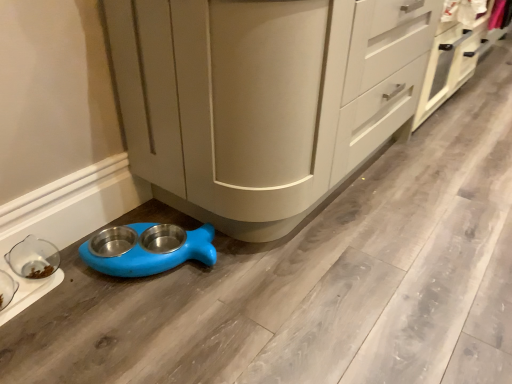
Where is `vacant space in between transparent glass bowl at lower left, which is the first appliance from left to right, and blue plastic pet feeder at lower left, which is the 2th appliance from left to right`? The width and height of the screenshot is (512, 384). vacant space in between transparent glass bowl at lower left, which is the first appliance from left to right, and blue plastic pet feeder at lower left, which is the 2th appliance from left to right is located at coordinates (92, 286).